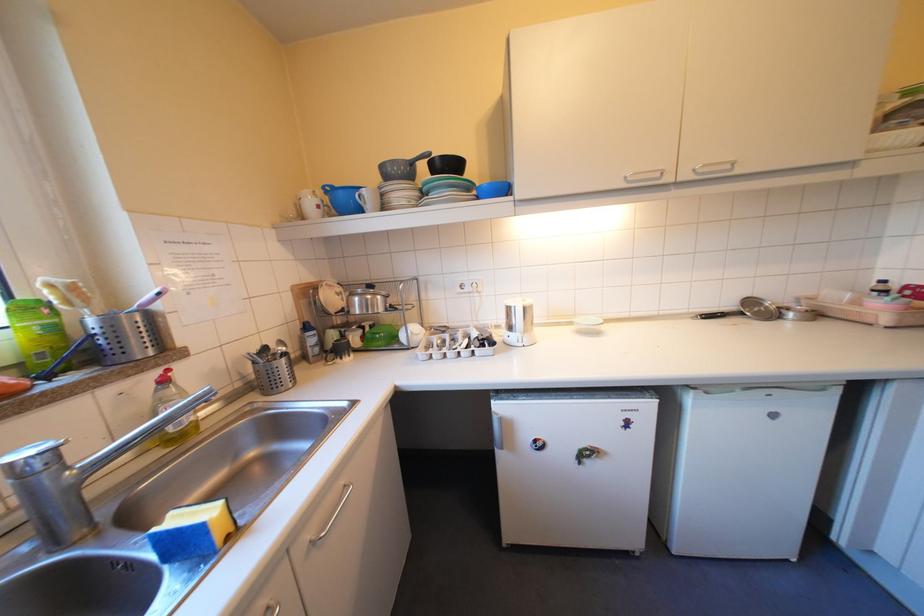
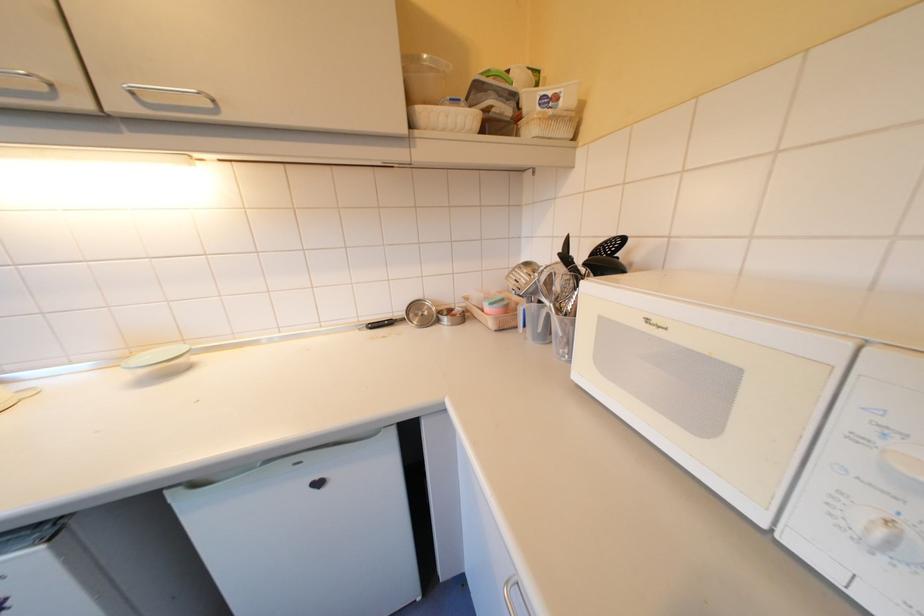
Question: What movement of the cameraman would produce the second image?

Choices:
 (A) Left
 (B) Right
 (C) Forward
 (D) Backward

Answer: (B)